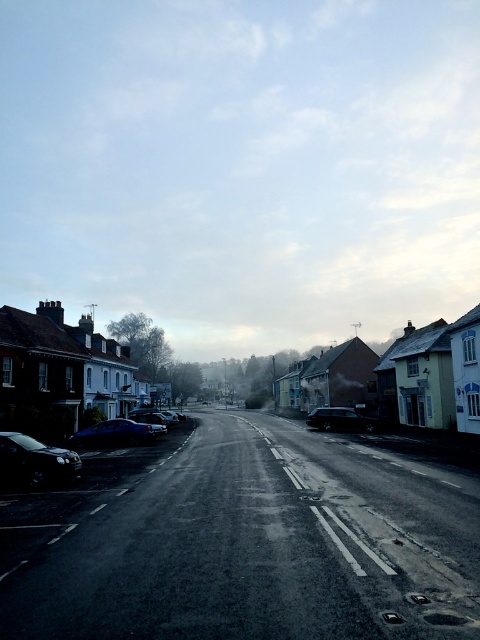
Which is in front, point (111, 433) or point (152, 429)?

Point (111, 433)

Can you confirm if shiny blue car at left is thinner than metallic blue car at center?

Incorrect, shiny blue car at left's width is not less than metallic blue car at center's.

Locate an element on the screen. Image resolution: width=480 pixels, height=640 pixels. shiny blue car at left is located at coordinates (113, 433).

The height and width of the screenshot is (640, 480). Describe the element at coordinates (113, 433) in the screenshot. I see `shiny blue car at left` at that location.

Who is more distant from viewer, (x=93, y=444) or (x=360, y=416)?

The point (x=360, y=416) is behind.

This screenshot has height=640, width=480. What do you see at coordinates (113, 433) in the screenshot?
I see `shiny blue car at left` at bounding box center [113, 433].

At what (x,y) coordinates should I click in order to perform the action: click on shiny blue car at left. Please return your answer as a coordinate pair (x, y). The height and width of the screenshot is (640, 480). Looking at the image, I should click on (113, 433).

Can you confirm if shiny black car at lower left is positioned to the left of metallic blue car at center?

Incorrect, shiny black car at lower left is not on the left side of metallic blue car at center.

Can you confirm if shiny black car at lower left is thinner than metallic blue car at center?

Indeed, shiny black car at lower left has a lesser width compared to metallic blue car at center.

The height and width of the screenshot is (640, 480). I want to click on shiny black car at lower left, so click(34, 460).